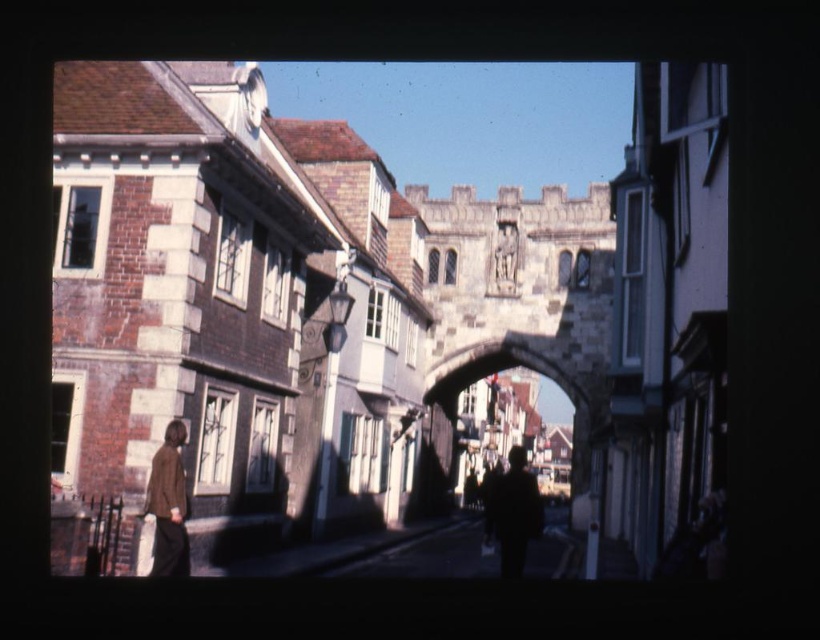
From the picture: Is brown leather jacket at lower left to the left of dark silhouette figure at center from the viewer's perspective?

Indeed, brown leather jacket at lower left is positioned on the left side of dark silhouette figure at center.

Measure the distance between brown leather jacket at lower left and camera.

brown leather jacket at lower left and camera are 53.69 meters apart.

What do you see at coordinates (167, 504) in the screenshot? I see `brown leather jacket at lower left` at bounding box center [167, 504].

Locate an element on the screen. This screenshot has width=820, height=640. brown leather jacket at lower left is located at coordinates point(167,504).

Is brick and stone archway at center smaller than dark silhouette figure at center?

No.

Is brick and stone archway at center to the left of dark silhouette figure at center from the viewer's perspective?

Incorrect, brick and stone archway at center is not on the left side of dark silhouette figure at center.

Does point (103, 192) come in front of point (522, 460)?

That is True.

Find the location of a particular element. The image size is (820, 640). brick and stone archway at center is located at coordinates (363, 314).

Which is behind, point (677, 464) or point (149, 509)?

The point (677, 464) is more distant.

Locate an element on the screen. Image resolution: width=820 pixels, height=640 pixels. brick and stone archway at center is located at coordinates (363, 314).